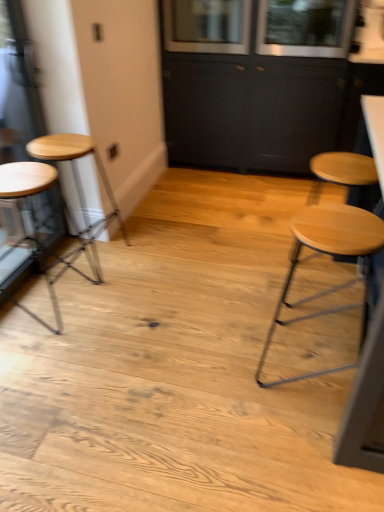
The image size is (384, 512). I want to click on clear glass window at upper center, the first window from the right, so click(x=305, y=28).

Identify the location of light wood stool at right, which appears as the 3th stool when viewed from the left. (331, 255).

Find the location of a particular element. This screenshot has height=512, width=384. the 3rd stool in front of the clear glass window at upper center, arranged as the second window when viewed from the right, counting from the anchor's position is located at coordinates (331, 255).

Between clear glass window at upper center, which is the 1th window in left-to-right order, and light wood stool at right, which appears as the first stool when viewed from the right, which one has larger width?

Wider between the two is clear glass window at upper center, which is the 1th window in left-to-right order.

Is clear glass window at upper center, which is the 1th window in left-to-right order, situated inside light wood stool at right, which appears as the 3th stool when viewed from the left, or outside?

clear glass window at upper center, which is the 1th window in left-to-right order, lies outside light wood stool at right, which appears as the 3th stool when viewed from the left.

Which is more to the right, clear glass window at upper center, arranged as the second window when viewed from the right, or light wood stool at right, which appears as the first stool when viewed from the right?

light wood stool at right, which appears as the first stool when viewed from the right.

From the image's perspective, is light brown wood stool at left, placed as the second stool when sorted from right to left, below wooden stool at left, the third stool in the right-to-left sequence?

No, from the image's perspective, light brown wood stool at left, placed as the second stool when sorted from right to left, is not beneath wooden stool at left, the third stool in the right-to-left sequence.

From a real-world perspective, who is located lower, light brown wood stool at left, which appears as the second stool when viewed from the left, or wooden stool at left, acting as the 1th stool starting from the left?

In real-world perspective, wooden stool at left, acting as the 1th stool starting from the left, is lower.

Who is smaller, light brown wood stool at left, placed as the second stool when sorted from right to left, or wooden stool at left, acting as the 1th stool starting from the left?

With smaller size is light brown wood stool at left, placed as the second stool when sorted from right to left.

Is light brown wood stool at left, which appears as the second stool when viewed from the left, placed right next to wooden stool at left, the third stool in the right-to-left sequence?

light brown wood stool at left, which appears as the second stool when viewed from the left, and wooden stool at left, the third stool in the right-to-left sequence, are not in contact.

Which object is further away from the camera taking this photo, clear glass window at upper center, the first window from the right, or clear glass window at upper center, which is the 1th window in left-to-right order?

clear glass window at upper center, which is the 1th window in left-to-right order, is further away from the camera.

Can you confirm if clear glass window at upper center, the first window from the right, is shorter than clear glass window at upper center, arranged as the second window when viewed from the right?

No.

From the picture: Is clear glass window at upper center, placed as the 2th window when sorted from left to right, oriented towards clear glass window at upper center, which is the 1th window in left-to-right order?

No.

Is clear glass window at upper center, the first window from the right, to the left of clear glass window at upper center, arranged as the second window when viewed from the right, from the viewer's perspective?

Incorrect, clear glass window at upper center, the first window from the right, is not on the left side of clear glass window at upper center, arranged as the second window when viewed from the right.

Is light brown wood stool at left, which appears as the second stool when viewed from the left, directly adjacent to clear glass window at upper center, which is the 1th window in left-to-right order?

light brown wood stool at left, which appears as the second stool when viewed from the left, and clear glass window at upper center, which is the 1th window in left-to-right order, are clearly separated.

How much distance is there between light brown wood stool at left, which appears as the second stool when viewed from the left, and clear glass window at upper center, arranged as the second window when viewed from the right?

A distance of 4.55 feet exists between light brown wood stool at left, which appears as the second stool when viewed from the left, and clear glass window at upper center, arranged as the second window when viewed from the right.

Looking at this image, is light brown wood stool at left, placed as the second stool when sorted from right to left, oriented away from clear glass window at upper center, which is the 1th window in left-to-right order?

That's not correct — light brown wood stool at left, placed as the second stool when sorted from right to left, is not looking away from clear glass window at upper center, which is the 1th window in left-to-right order.

Can you confirm if light brown wood stool at left, placed as the second stool when sorted from right to left, is bigger than clear glass window at upper center, which is the 1th window in left-to-right order?

No.

Consider the image. Is light wood stool at right, which appears as the 3th stool when viewed from the left, turned away from light brown wood stool at left, which appears as the second stool when viewed from the left?

Yes, light wood stool at right, which appears as the 3th stool when viewed from the left, is positioned with its back facing light brown wood stool at left, which appears as the second stool when viewed from the left.

Considering the sizes of objects light wood stool at right, which appears as the 3th stool when viewed from the left, and light brown wood stool at left, placed as the second stool when sorted from right to left, in the image provided, who is smaller, light wood stool at right, which appears as the 3th stool when viewed from the left, or light brown wood stool at left, placed as the second stool when sorted from right to left,?

light brown wood stool at left, placed as the second stool when sorted from right to left.

Are light wood stool at right, which appears as the 3th stool when viewed from the left, and light brown wood stool at left, which appears as the second stool when viewed from the left, far apart?

Yes, light wood stool at right, which appears as the 3th stool when viewed from the left, and light brown wood stool at left, which appears as the second stool when viewed from the left, are quite far apart.

Based on the photo, from a real-world perspective, between light wood stool at right, which appears as the 3th stool when viewed from the left, and light brown wood stool at left, which appears as the second stool when viewed from the left, who is vertically lower?

light wood stool at right, which appears as the 3th stool when viewed from the left, is physically lower.

Is light brown wood stool at left, which appears as the second stool when viewed from the left, turned away from light wood stool at right, which appears as the 3th stool when viewed from the left?

No.

Would you consider light brown wood stool at left, which appears as the second stool when viewed from the left, to be distant from light wood stool at right, which appears as the first stool when viewed from the right?

Indeed, light brown wood stool at left, which appears as the second stool when viewed from the left, is not near light wood stool at right, which appears as the first stool when viewed from the right.

Is light brown wood stool at left, placed as the second stool when sorted from right to left, situated inside light wood stool at right, which appears as the first stool when viewed from the right, or outside?

light brown wood stool at left, placed as the second stool when sorted from right to left, is located beyond the bounds of light wood stool at right, which appears as the first stool when viewed from the right.

This screenshot has height=512, width=384. I want to click on the 2nd stool in front when counting from the light brown wood stool at left, placed as the second stool when sorted from right to left, so click(x=331, y=255).

Which is in front, clear glass window at upper center, the first window from the right, or matte black cabinet at upper center?

matte black cabinet at upper center is closer to the camera.

Consider the image. Between clear glass window at upper center, the first window from the right, and matte black cabinet at upper center, which one has less height?

With less height is clear glass window at upper center, the first window from the right.

Is point (311, 41) positioned before point (257, 83)?

Yes, point (311, 41) is closer to viewer.

Is clear glass window at upper center, placed as the 2th window when sorted from left to right, facing away from matte black cabinet at upper center?

Yes, matte black cabinet at upper center is at the back of clear glass window at upper center, placed as the 2th window when sorted from left to right.

Locate an element on the screen. Image resolution: width=384 pixels, height=512 pixels. window that is the 2nd object located above the light wood stool at right, which appears as the first stool when viewed from the right (from the image's perspective) is located at coordinates (207, 26).

This screenshot has width=384, height=512. In order to click on the 1st stool positioned below the light brown wood stool at left, which appears as the second stool when viewed from the left (from a real-world perspective) in this screenshot , I will do `click(25, 179)`.

From the image, which object appears to be farther from light wood stool at right, which appears as the 3th stool when viewed from the left, clear glass window at upper center, placed as the 2th window when sorted from left to right, or light brown wood stool at left, placed as the second stool when sorted from right to left?

clear glass window at upper center, placed as the 2th window when sorted from left to right.

Looking at this image, from the image, which object appears to be farther from light brown wood stool at left, which appears as the second stool when viewed from the left, clear glass window at upper center, the first window from the right, or wooden stool at left, acting as the 1th stool starting from the left?

clear glass window at upper center, the first window from the right, is positioned further to the anchor light brown wood stool at left, which appears as the second stool when viewed from the left.

When comparing their distances from matte black cabinet at upper center, does wooden stool at left, the third stool in the right-to-left sequence, or clear glass window at upper center, which is the 1th window in left-to-right order, seem closer?

clear glass window at upper center, which is the 1th window in left-to-right order, is positioned closer to the anchor matte black cabinet at upper center.

When comparing their distances from matte black cabinet at upper center, does light brown wood stool at left, which appears as the second stool when viewed from the left, or clear glass window at upper center, placed as the 2th window when sorted from left to right, seem further?

Among the two, light brown wood stool at left, which appears as the second stool when viewed from the left, is located further to matte black cabinet at upper center.

Which object lies further to the anchor point light wood stool at right, which appears as the first stool when viewed from the right, light brown wood stool at left, placed as the second stool when sorted from right to left, or wooden stool at left, the third stool in the right-to-left sequence?

The object further to light wood stool at right, which appears as the first stool when viewed from the right, is wooden stool at left, the third stool in the right-to-left sequence.

Which object lies nearer to the anchor point light wood stool at right, which appears as the first stool when viewed from the right, wooden stool at left, acting as the 1th stool starting from the left, or clear glass window at upper center, which is the 1th window in left-to-right order?

wooden stool at left, acting as the 1th stool starting from the left.

When comparing their distances from light wood stool at right, which appears as the 3th stool when viewed from the left, does clear glass window at upper center, which is the 1th window in left-to-right order, or matte black cabinet at upper center seem closer?

Based on the image, matte black cabinet at upper center appears to be nearer to light wood stool at right, which appears as the 3th stool when viewed from the left.

Considering their positions, is wooden stool at left, acting as the 1th stool starting from the left, positioned further to light brown wood stool at left, which appears as the second stool when viewed from the left, than clear glass window at upper center, arranged as the second window when viewed from the right?

clear glass window at upper center, arranged as the second window when viewed from the right, is further to light brown wood stool at left, which appears as the second stool when viewed from the left.

Identify the location of cabinetry between clear glass window at upper center, arranged as the second window when viewed from the right, and light brown wood stool at left, which appears as the second stool when viewed from the left, vertically. This screenshot has height=512, width=384. (250, 110).

This screenshot has width=384, height=512. I want to click on window between clear glass window at upper center, which is the 1th window in left-to-right order, and light brown wood stool at left, which appears as the second stool when viewed from the left, in the up-down direction, so click(305, 28).

What are the coordinates of `cabinetry that lies between clear glass window at upper center, the first window from the right, and light wood stool at right, which appears as the first stool when viewed from the right, from top to bottom` in the screenshot? It's located at (250, 110).

This screenshot has width=384, height=512. I want to click on cabinetry between clear glass window at upper center, which is the 1th window in left-to-right order, and light wood stool at right, which appears as the first stool when viewed from the right, in the up-down direction, so click(250, 110).